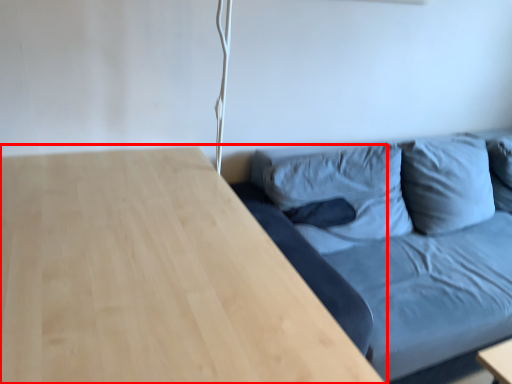
Question: Where is table (annotated by the red box) located in relation to studio couch in the image?

Choices:
 (A) right
 (B) left

Answer: (B)